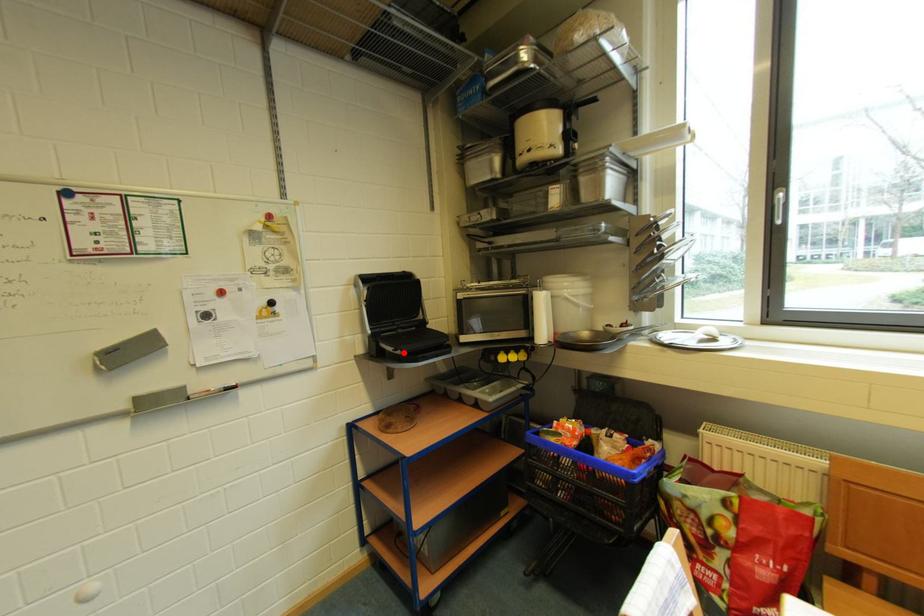
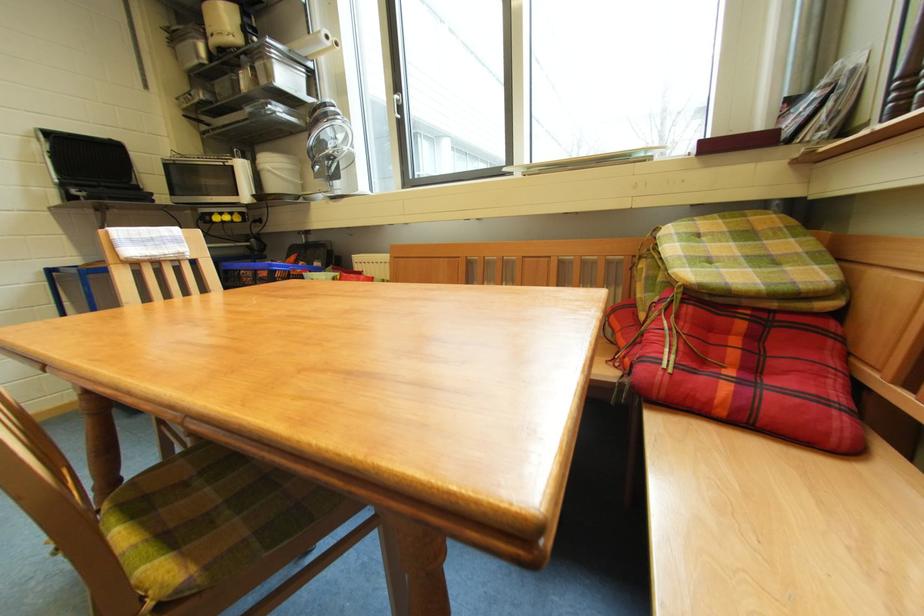
Locate, in the second image, the point that corresponds to the highlighted location in the first image.

(88, 193)